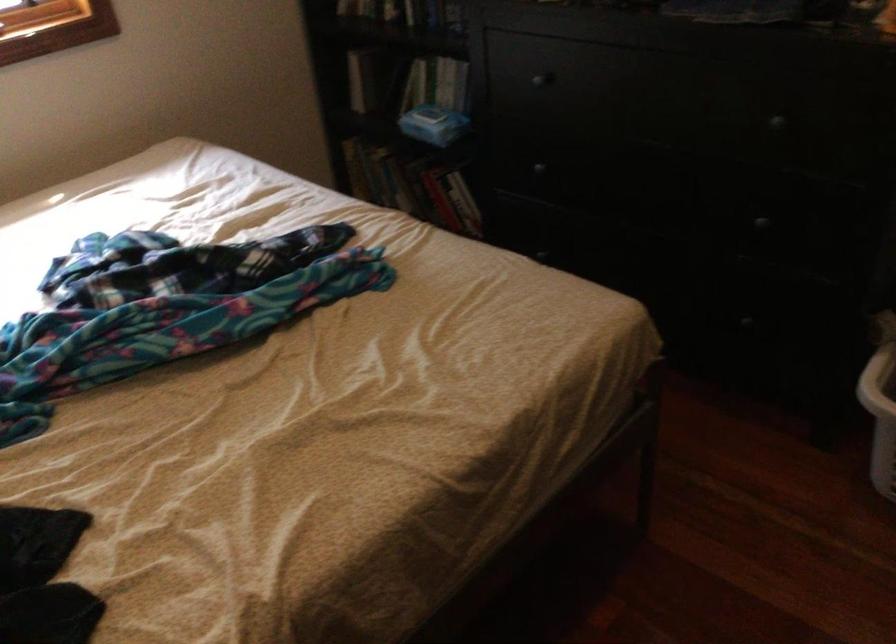
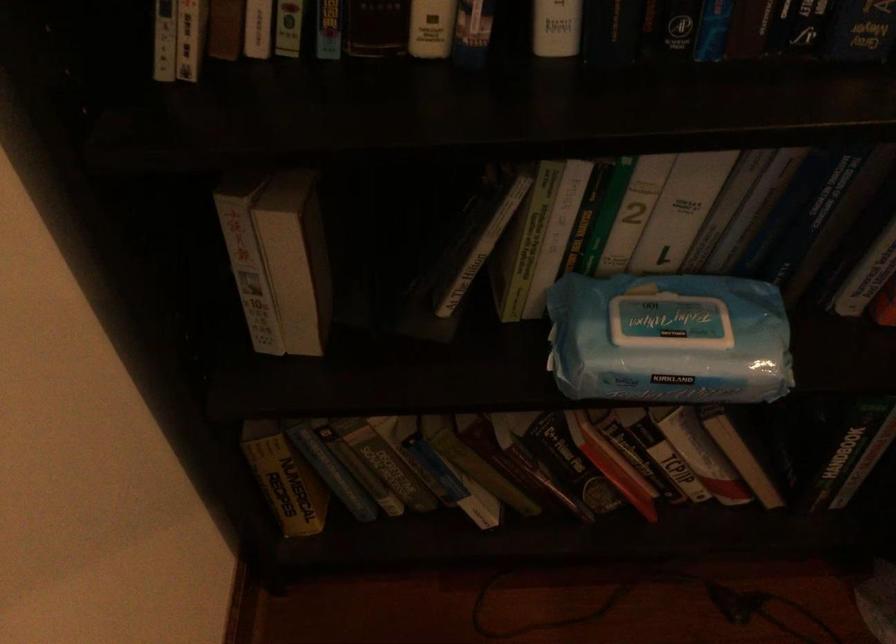
Locate, in the second image, the point that corresponds to (x=437, y=194) in the first image.

(610, 464)